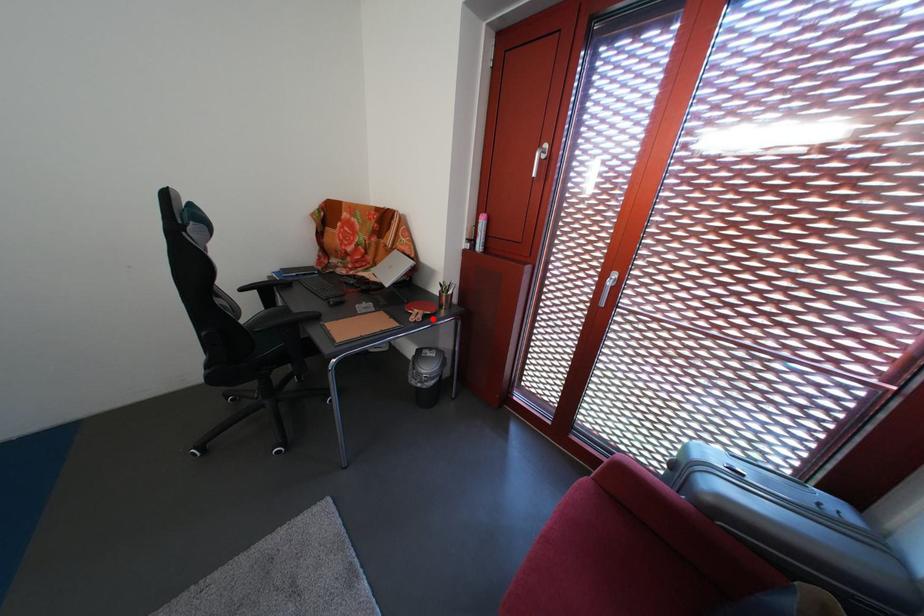
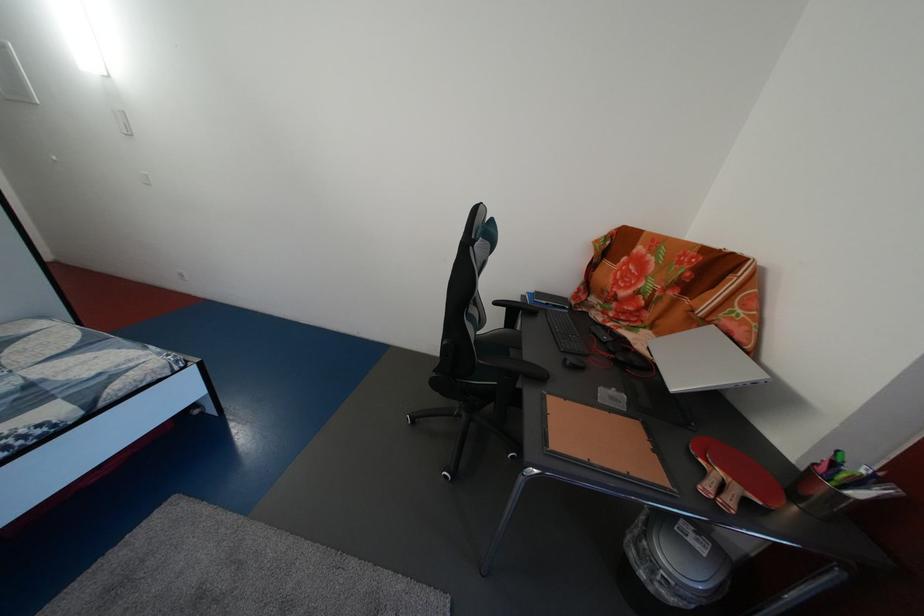
In the second image, find the point that corresponds to the highlighted location in the first image.

(748, 496)